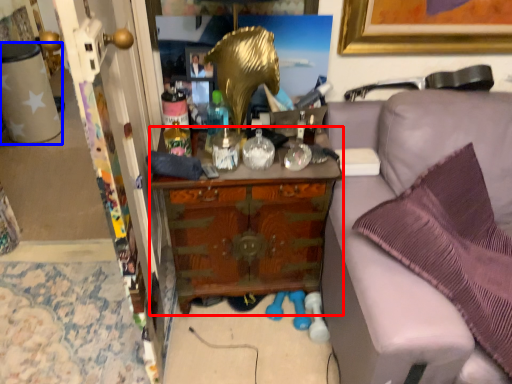
Question: Which object is closer to the camera taking this photo, cabinetry (highlighted by a red box) or desk (highlighted by a blue box)?

Choices:
 (A) cabinetry
 (B) desk

Answer: (A)